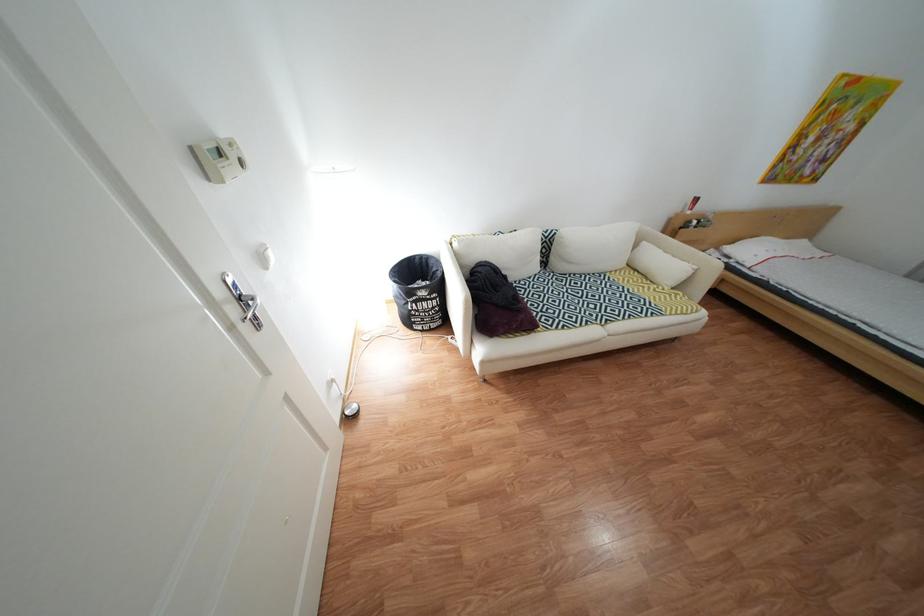
I want to click on sofa armrest, so click(455, 285).